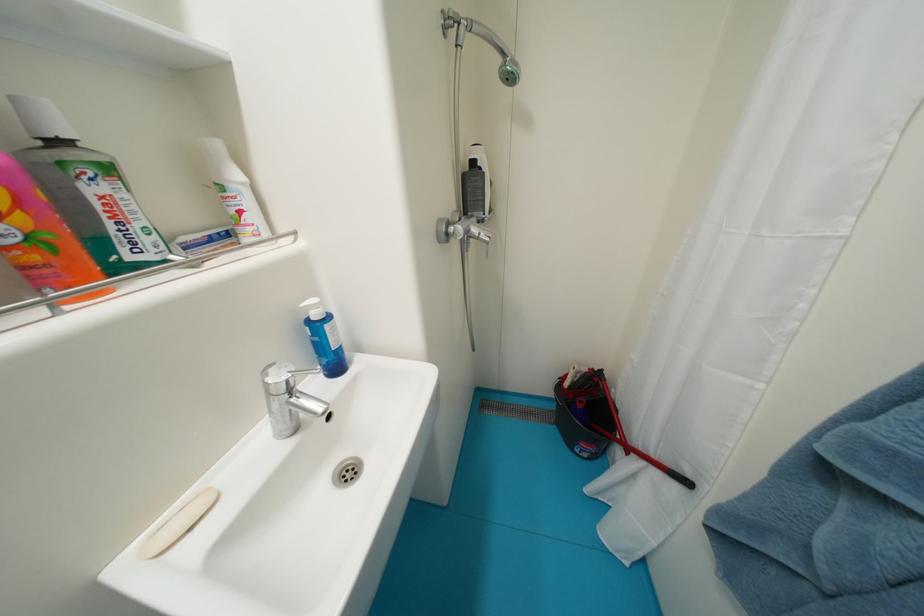
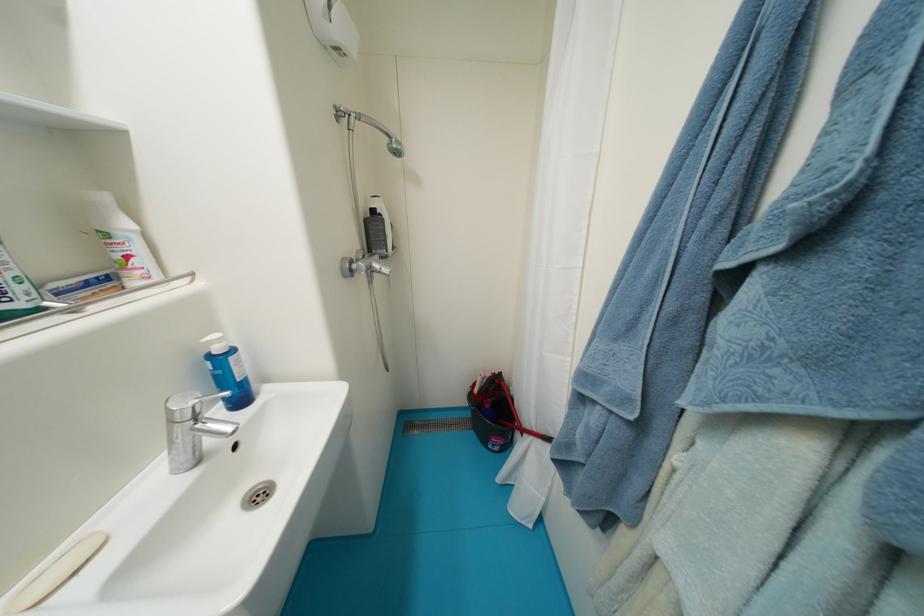
In the second image, find the point that corresponds to [247,214] in the first image.

(134, 259)